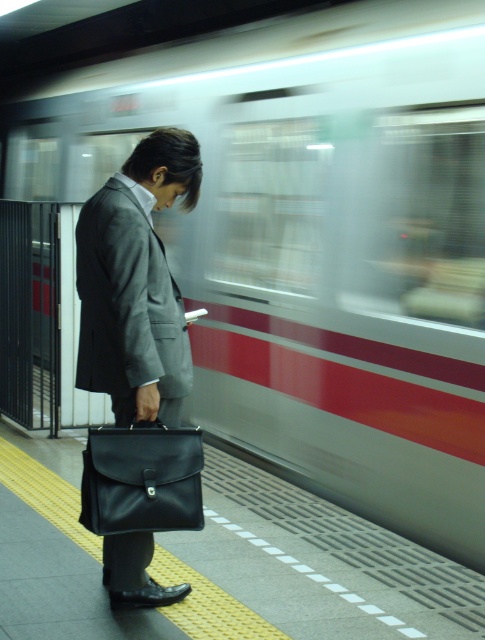
Question: Where is gray matte suit at center located in relation to black leather briefcase at lower center in the image?

Choices:
 (A) right
 (B) left

Answer: (B)

Question: Which point appears farthest from the camera in this image?

Choices:
 (A) (147, 451)
 (B) (76, 387)

Answer: (B)

Question: Which object appears farthest from the camera in this image?

Choices:
 (A) gray matte suit at center
 (B) black leather briefcase at lower center

Answer: (A)

Question: Does gray matte suit at center have a greater width compared to black leather briefcase at lower center?

Choices:
 (A) yes
 (B) no

Answer: (B)

Question: Can you confirm if gray matte suit at center is wider than black leather briefcase at lower center?

Choices:
 (A) no
 (B) yes

Answer: (A)